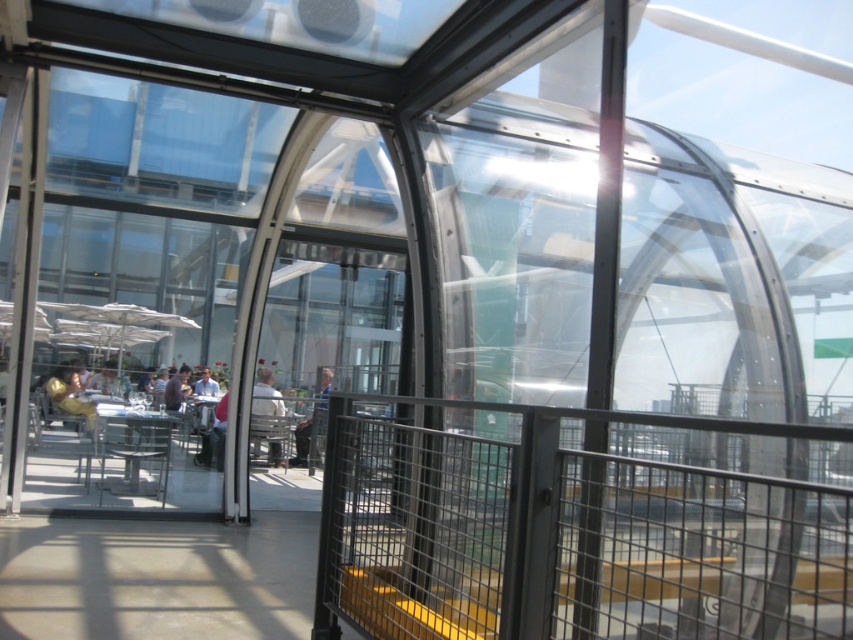
Does transparent glass door at center appear over light brown leather jacket at center?

Yes.

Can you confirm if transparent glass door at center is positioned to the left of light brown leather jacket at center?

In fact, transparent glass door at center is to the right of light brown leather jacket at center.

Does point (643, 292) lie in front of point (277, 410)?

Yes.

Where is `transparent glass door at center`? transparent glass door at center is located at coordinates (515, 244).

In the scene shown: Can you confirm if golden yellow jacket at left is positioned above blue denim jeans at center?

Yes, golden yellow jacket at left is above blue denim jeans at center.

Based on the photo, does golden yellow jacket at left appear on the right side of blue denim jeans at center?

No, golden yellow jacket at left is not to the right of blue denim jeans at center.

Describe the element at coordinates (68, 394) in the screenshot. The image size is (853, 640). I see `golden yellow jacket at left` at that location.

Image resolution: width=853 pixels, height=640 pixels. In order to click on golden yellow jacket at left in this screenshot , I will do `click(68, 394)`.

Which of these two, black wire mesh railing at center or blue denim jeans at center, stands taller?

black wire mesh railing at center

Locate an element on the screen. Image resolution: width=853 pixels, height=640 pixels. black wire mesh railing at center is located at coordinates (573, 529).